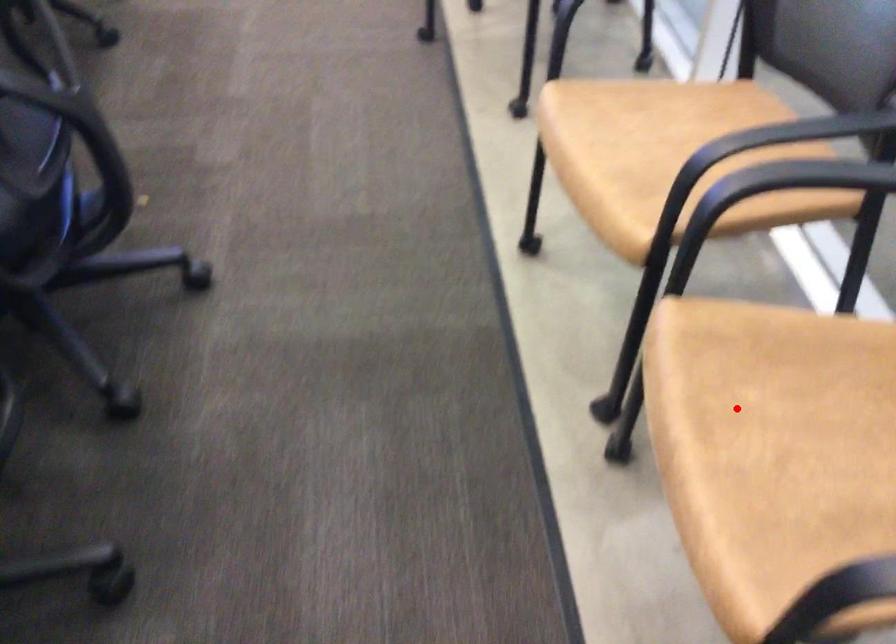
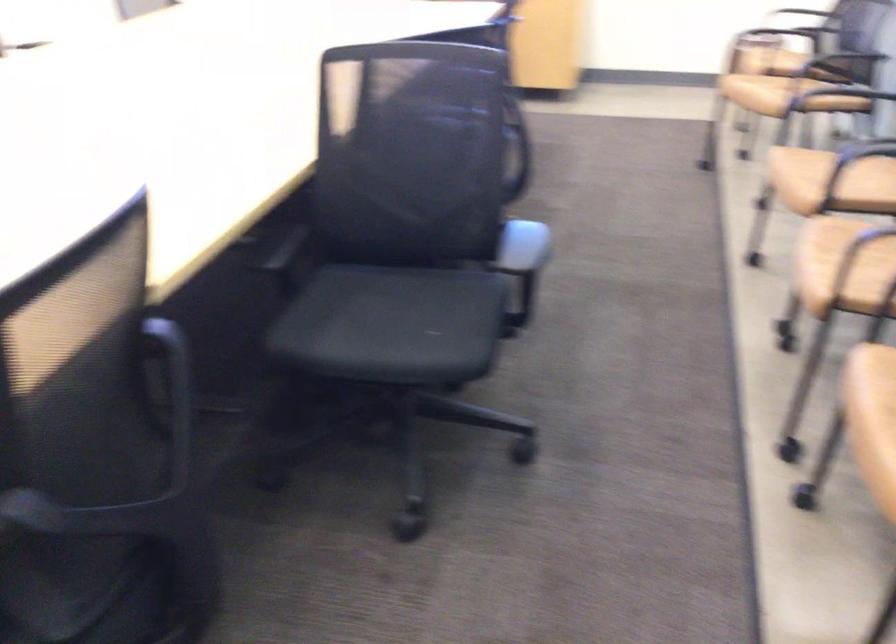
Locate, in the second image, the point that corresponds to the highlighted location in the first image.

(842, 242)